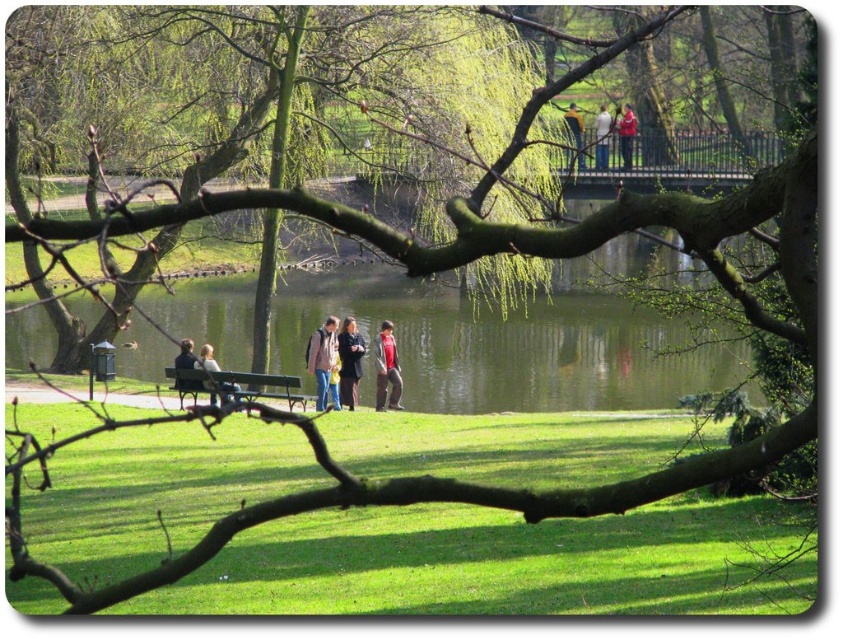
Who is shorter, light brown leather jacket at upper center or dark blue jacket at lower left?

dark blue jacket at lower left is shorter.

Between light brown leather jacket at upper center and dark blue jacket at lower left, which one has more height?

Standing taller between the two is light brown leather jacket at upper center.

Identify the location of light brown leather jacket at upper center. This screenshot has width=843, height=640. (602, 138).

The image size is (843, 640). I want to click on light brown leather jacket at upper center, so click(602, 138).

In the scene shown: Between matte brown jacket at center and light brown leather jacket at center, which one is positioned lower?

light brown leather jacket at center is below.

Between matte brown jacket at center and light brown leather jacket at center, which one is positioned higher?

Positioned higher is matte brown jacket at center.

Image resolution: width=843 pixels, height=640 pixels. Describe the element at coordinates (321, 358) in the screenshot. I see `matte brown jacket at center` at that location.

Locate an element on the screen. matte brown jacket at center is located at coordinates (321, 358).

Is point (353, 356) positioned in front of point (578, 157)?

Yes, point (353, 356) is in front of point (578, 157).

Consider the image. Measure the distance from dark gray coat at center to golden textured hair at upper center.

dark gray coat at center and golden textured hair at upper center are 8.13 meters apart from each other.

Between point (352, 388) and point (568, 106), which one is positioned behind?

The point (568, 106) is behind.

Identify the location of dark gray coat at center. (348, 362).